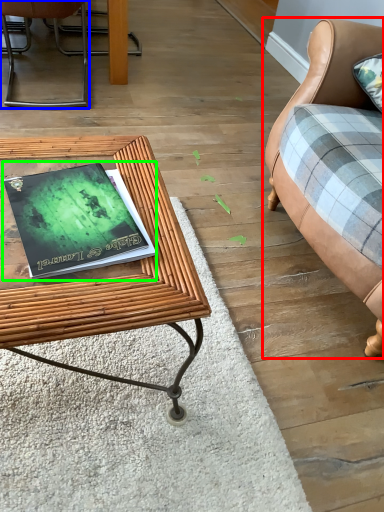
Question: Which object is positioned farthest from studio couch (highlighted by a red box)? Select from chair (highlighted by a blue box) and paperback book (highlighted by a green box).

Choices:
 (A) chair
 (B) paperback book

Answer: (A)